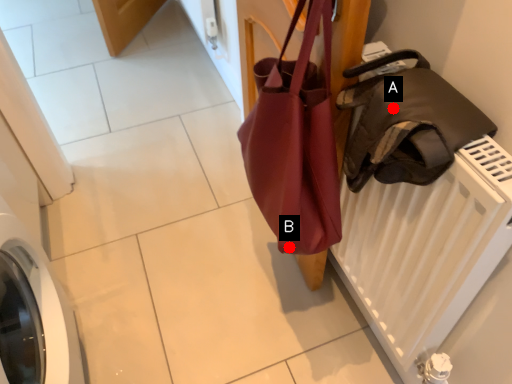
Question: Two points are circled on the image, labeled by A and B beside each circle. Which point is closer to the camera taking this photo?

Choices:
 (A) A is closer
 (B) B is closer

Answer: (A)